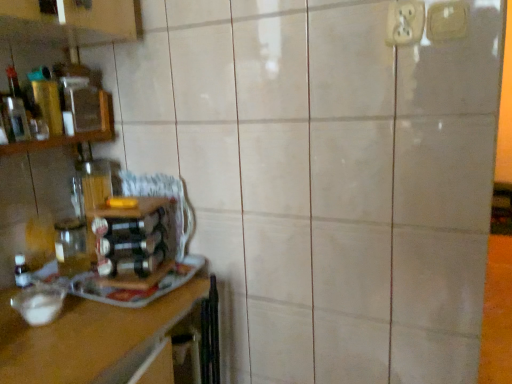
Question: In the image, is translucent glass bottle at left on the left side or the right side of wooden at left?

Choices:
 (A) right
 (B) left

Answer: (A)

Question: From a real-world perspective, relative to wooden at left, is translucent glass bottle at left vertically above or below?

Choices:
 (A) above
 (B) below

Answer: (A)

Question: Estimate the real-world distances between objects in this image. Which object is farther from the white plastic electric outlet at upper right, the 2th electric outlet from the left?

Choices:
 (A) wooden shelf at left
 (B) wooden at left
 (C) translucent glass bottle at left
 (D) white plastic electric outlet at upper right, positioned as the second electric outlet in right-to-left order

Answer: (B)

Question: Which is nearer to the translucent glass bottle at left?

Choices:
 (A) wooden at left
 (B) wooden shelf at left
 (C) white plastic electric outlet at upper right, which is counted as the 1th electric outlet, starting from the left
 (D) white plastic electric outlet at upper right, the 2th electric outlet from the left

Answer: (A)